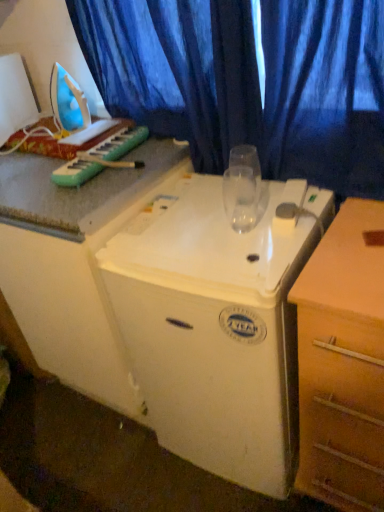
At what (x,y) coordinates should I click in order to perform the action: click on free space above wooden chest of drawers at right (from a real-world perspective). Please return your answer as a coordinate pair (x, y). The width and height of the screenshot is (384, 512). Looking at the image, I should click on (357, 238).